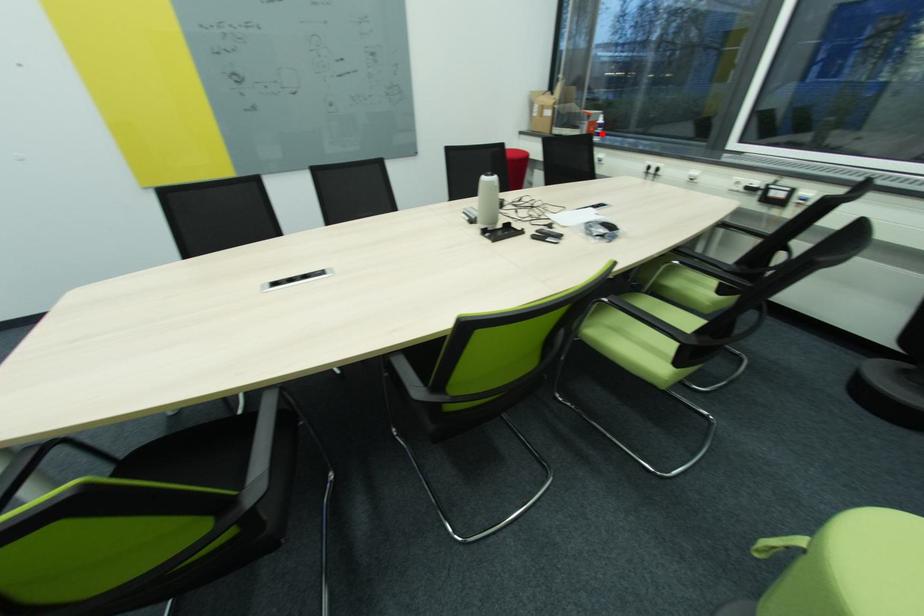
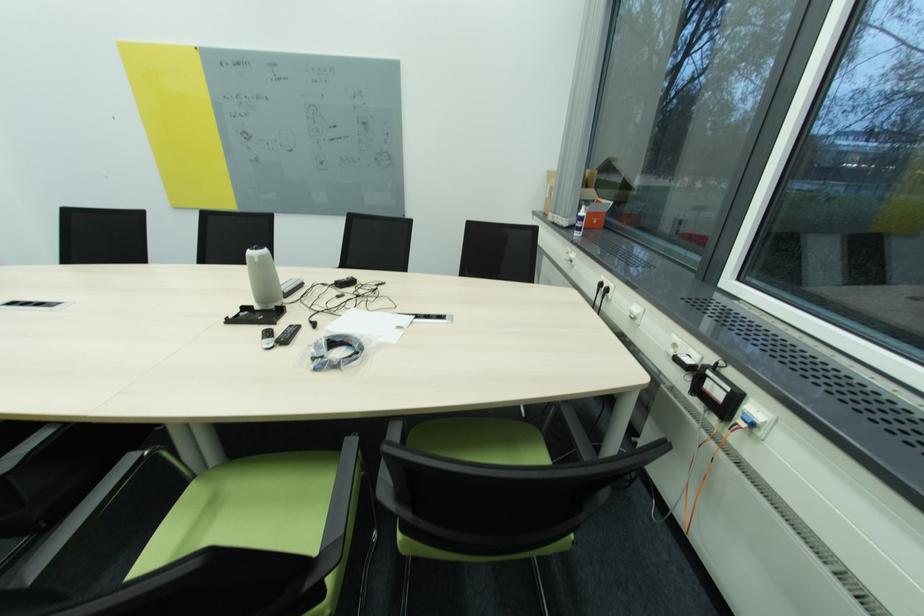
The point at the highlighted location is marked in the first image. Where is the corresponding point in the second image?

(581, 228)